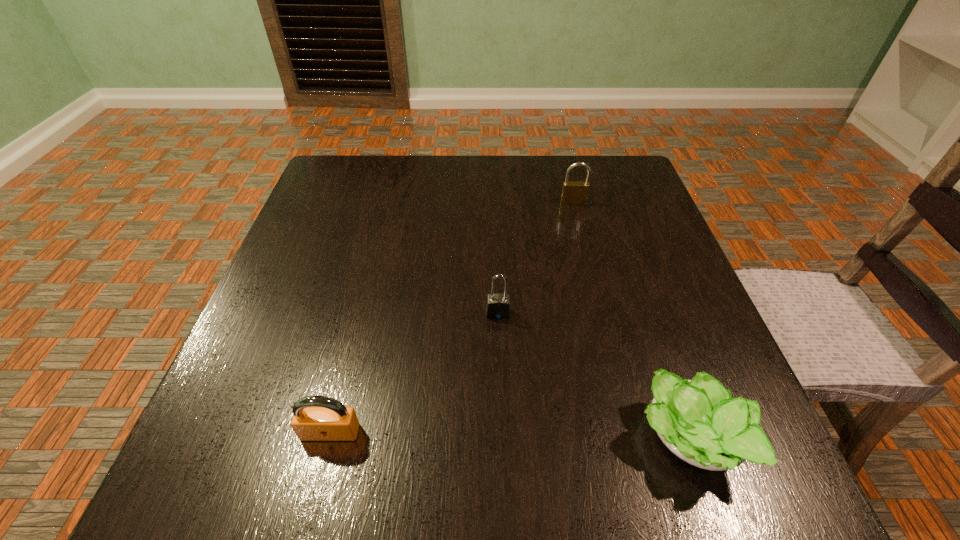
I want to click on vacant area that lies between the farthest object and the lettuce, so click(631, 321).

At what (x,y) coordinates should I click in order to perform the action: click on free space between the leftmost padlock and the rightmost padlock. Please return your answer as a coordinate pair (x, y). The image size is (960, 540). Looking at the image, I should click on (452, 317).

Image resolution: width=960 pixels, height=540 pixels. Find the location of `free space between the shortest object and the farthest object`. free space between the shortest object and the farthest object is located at coordinates pos(631,321).

At what (x,y) coordinates should I click in order to perform the action: click on empty space that is in between the third nearest object and the shortest object. Please return your answer as a coordinate pair (x, y). Looking at the image, I should click on (593, 376).

Where is `free point between the farthest padlock and the second farthest padlock`? This screenshot has width=960, height=540. free point between the farthest padlock and the second farthest padlock is located at coordinates (536, 258).

The width and height of the screenshot is (960, 540). I want to click on free point between the lettuce and the farthest object, so click(631, 321).

Choose which object is the nearest neighbor to the shortest object. Please provide its 2D coordinates. Your answer should be formatted as a tuple, i.e. [(x, y)], where the tuple contains the x and y coordinates of a point satisfying the conditions above.

[(498, 305)]

Point out which object is positioned as the third nearest to the leftmost padlock. Please provide its 2D coordinates. Your answer should be formatted as a tuple, i.e. [(x, y)], where the tuple contains the x and y coordinates of a point satisfying the conditions above.

[(573, 192)]

Identify the location of padlock that can be found as the closest to the farthest object. (498, 305).

Locate which padlock ranks in proximity to the second padlock from left to right. Please provide its 2D coordinates. Your answer should be formatted as a tuple, i.e. [(x, y)], where the tuple contains the x and y coordinates of a point satisfying the conditions above.

[(315, 418)]